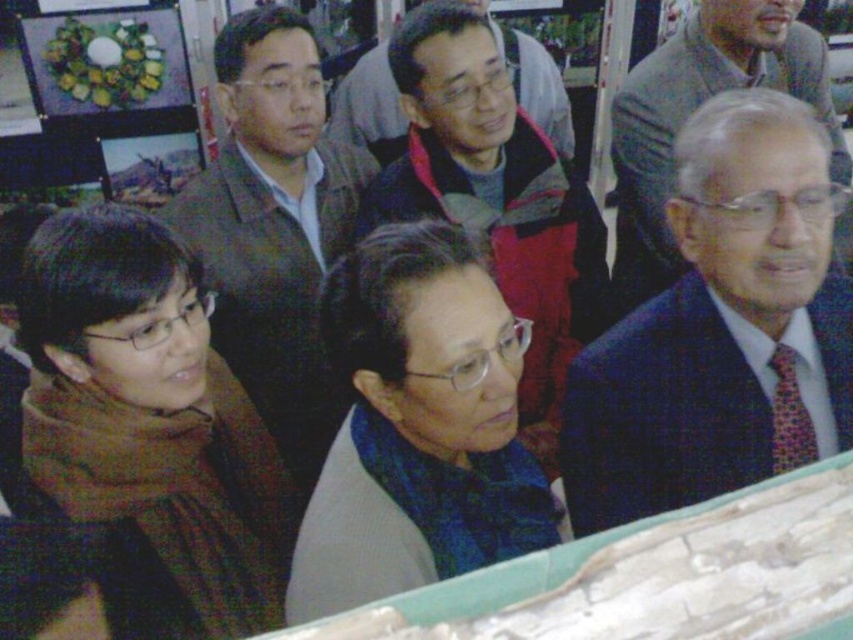
Where is `dark blue suit at right`? dark blue suit at right is located at coordinates (718, 326).

Who is higher up, dark blue suit at right or gray wool sweater at center?

gray wool sweater at center is above.

What do you see at coordinates (718, 326) in the screenshot? I see `dark blue suit at right` at bounding box center [718, 326].

Identify the location of dark blue suit at right. (718, 326).

Can you confirm if brown wool scarf at left is bigger than gray wool sweater at center?

Incorrect, brown wool scarf at left is not larger than gray wool sweater at center.

Is brown wool scarf at left shorter than gray wool sweater at center?

No, brown wool scarf at left is not shorter than gray wool sweater at center.

Which is behind, point (279, 547) or point (544, 90)?

Point (544, 90)

Find the location of a particular element. This screenshot has width=853, height=640. brown wool scarf at left is located at coordinates 149,429.

Which is more to the left, dark blue suit at right or blue fabric scarf at center?

blue fabric scarf at center is more to the left.

Is dark blue suit at right to the right of blue fabric scarf at center from the viewer's perspective?

Correct, you'll find dark blue suit at right to the right of blue fabric scarf at center.

Is point (799, 396) behind point (343, 296)?

Yes.

I want to click on dark blue suit at right, so pyautogui.click(x=718, y=326).